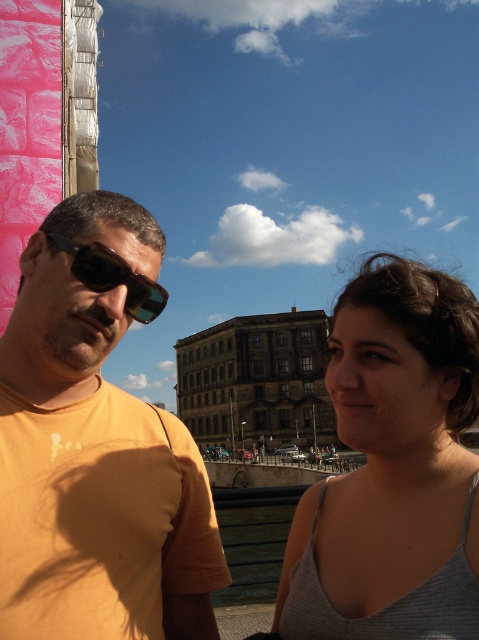
Does matte orange t-shirt at center have a greater height compared to black reflective sunglasses at left?

Yes.

At what (x,y) coordinates should I click in order to perform the action: click on matte orange t-shirt at center. Please return your answer as a coordinate pair (x, y). The height and width of the screenshot is (640, 479). Looking at the image, I should click on (95, 445).

Which is below, gray fabric tank top at center or black reflective sunglasses at left?

gray fabric tank top at center is lower down.

Can you confirm if gray fabric tank top at center is thinner than black reflective sunglasses at left?

No.

Is point (361, 628) closer to viewer compared to point (109, 280)?

Yes, point (361, 628) is closer to viewer.

Where is `gray fabric tank top at center`? This screenshot has height=640, width=479. gray fabric tank top at center is located at coordinates (392, 468).

Between matte orange t-shirt at left and gray fabric tank top at center, which one appears on the left side from the viewer's perspective?

matte orange t-shirt at left

Is matte orange t-shirt at left bigger than gray fabric tank top at center?

Yes.

Where is `matte orange t-shirt at left`? Image resolution: width=479 pixels, height=640 pixels. matte orange t-shirt at left is located at coordinates (95, 449).